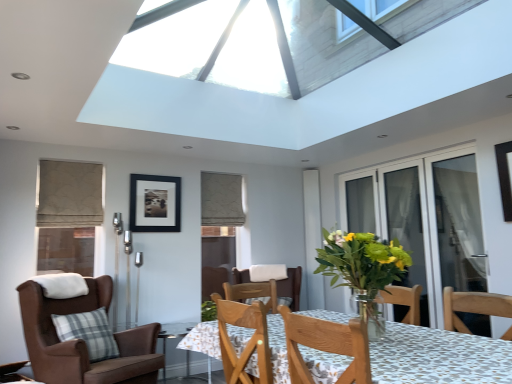
Question: Considering the relative sizes of brown leather chair at left and transparent glass door at right, placed as the 2th screen door when sorted from back to front, in the image provided, is brown leather chair at left wider than transparent glass door at right, placed as the 2th screen door when sorted from back to front,?

Choices:
 (A) no
 (B) yes

Answer: (B)

Question: Can you confirm if brown leather chair at left is shorter than transparent glass door at right, placed as the 2th screen door when sorted from back to front?

Choices:
 (A) no
 (B) yes

Answer: (B)

Question: Is brown leather chair at left with transparent glass door at right, placed as the 2th screen door when sorted from back to front?

Choices:
 (A) yes
 (B) no

Answer: (B)

Question: Is brown leather chair at left not close to transparent glass door at right, the 1th screen door positioned from the front?

Choices:
 (A) no
 (B) yes

Answer: (B)

Question: From the image's perspective, is brown leather chair at left beneath transparent glass door at right, the 1th screen door positioned from the front?

Choices:
 (A) yes
 (B) no

Answer: (A)

Question: From the image's perspective, is brown leather chair at left over transparent glass door at right, placed as the 2th screen door when sorted from back to front?

Choices:
 (A) yes
 (B) no

Answer: (B)

Question: From the image's perspective, is transparent glass door at right, the 1th screen door positioned from the front, under patterned fabric table at center?

Choices:
 (A) no
 (B) yes

Answer: (A)

Question: Considering the relative sizes of transparent glass door at right, placed as the 2th screen door when sorted from back to front, and patterned fabric table at center in the image provided, is transparent glass door at right, placed as the 2th screen door when sorted from back to front, shorter than patterned fabric table at center?

Choices:
 (A) no
 (B) yes

Answer: (A)

Question: Can you confirm if transparent glass door at right, placed as the 2th screen door when sorted from back to front, is smaller than patterned fabric table at center?

Choices:
 (A) yes
 (B) no

Answer: (A)

Question: Can you confirm if transparent glass door at right, the 1th screen door positioned from the front, is taller than patterned fabric table at center?

Choices:
 (A) yes
 (B) no

Answer: (A)

Question: Can you confirm if transparent glass door at right, placed as the 2th screen door when sorted from back to front, is positioned to the left of patterned fabric table at center?

Choices:
 (A) yes
 (B) no

Answer: (B)

Question: Does transparent glass door at right, placed as the 2th screen door when sorted from back to front, have a greater width compared to patterned fabric table at center?

Choices:
 (A) yes
 (B) no

Answer: (B)

Question: Could translucent glass vase at center be considered to be inside transparent glass table at lower center?

Choices:
 (A) yes
 (B) no

Answer: (B)